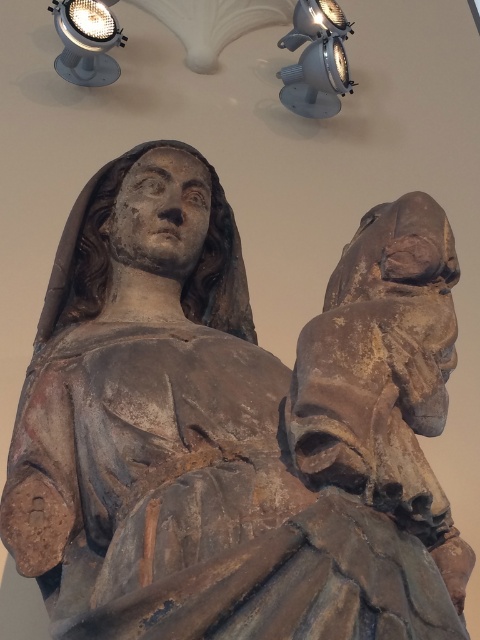
You are an art conservator examining the weathered wooden sculpture. You need to install a protective cover over it. The cover must be positioned so that it does not block the metallic industrial spotlight at upper center. Where should you place the cover relative to the spotlight?

The metallic industrial spotlight at upper center is located at point (315, 60). To avoid blocking it, the protective cover should be placed below or to the sides of this position, ensuring the spotlight remains unobstructed.

You are an art conservator assessing the lighting setup for the wooden sculpture. You have two spotlights available. The metallic industrial spotlight at upper center and the matte silver spotlight at upper left. Which spotlight should you use if you need a larger one to ensure proper illumination of the entire sculpture?

The metallic industrial spotlight at upper center is larger in size than the matte silver spotlight at upper left, so you should use the metallic industrial spotlight at upper center to ensure proper illumination of the entire sculpture.